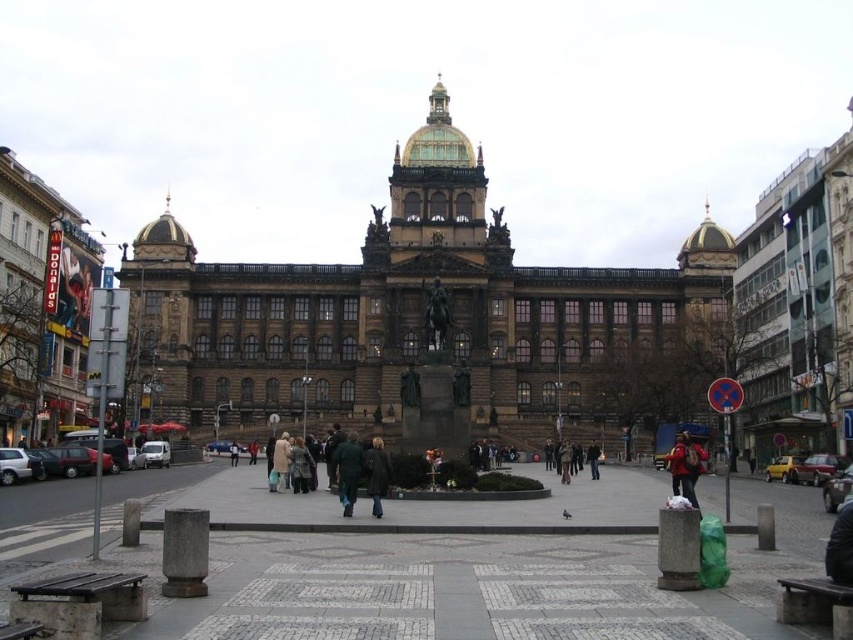
Which of these two, red fabric backpack at lower right or dark brown leather coat at center, stands taller?

With more height is dark brown leather coat at center.

Who is more forward, (x=691, y=449) or (x=376, y=474)?

Point (x=376, y=474)

What do you see at coordinates (683, 467) in the screenshot?
I see `red fabric backpack at lower right` at bounding box center [683, 467].

The height and width of the screenshot is (640, 853). I want to click on red fabric backpack at lower right, so click(x=683, y=467).

Between dark green jacket at center and dark brown leather coat at center, which one appears on the left side from the viewer's perspective?

dark green jacket at center is more to the left.

Is dark green jacket at center bigger than dark brown leather coat at center?

Correct, dark green jacket at center is larger in size than dark brown leather coat at center.

This screenshot has width=853, height=640. What are the coordinates of `dark green jacket at center` in the screenshot? It's located at (347, 470).

The image size is (853, 640). Find the location of `dark green jacket at center`. dark green jacket at center is located at coordinates (347, 470).

Is point (683, 436) farther from viewer compared to point (341, 472)?

Yes, it is behind point (341, 472).

The width and height of the screenshot is (853, 640). In order to click on red fabric backpack at lower right in this screenshot , I will do `click(683, 467)`.